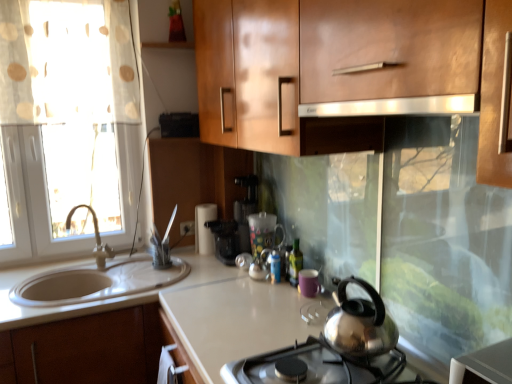
I want to click on vacant space situated on the left part of green glass bottle at center, so click(x=256, y=291).